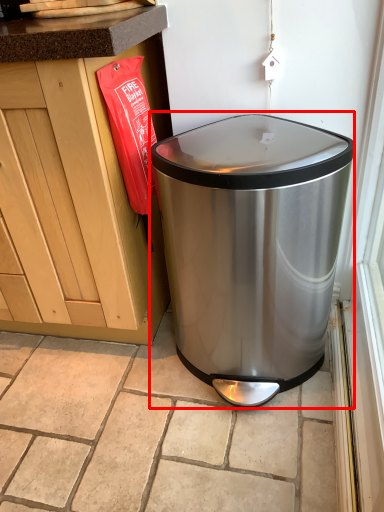
Question: From the image, what is the correct spatial relationship of waste container (annotated by the red box) in relation to tile?

Choices:
 (A) left
 (B) right

Answer: (B)